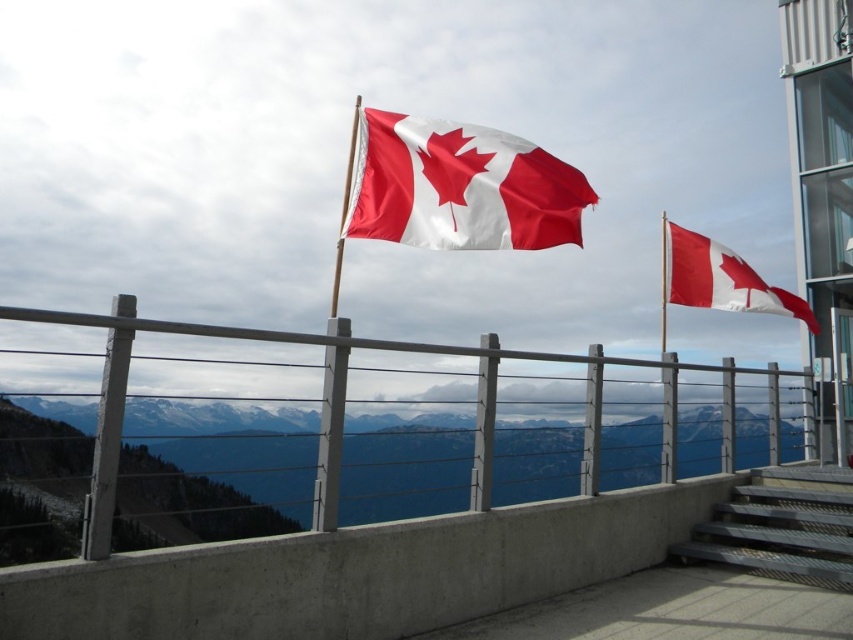
Based on the photo, you are standing at the overlook and want to descend to the parking lot below. The metallic gray stairs at lower right is your only path. If you can walk 3 feet per second, how many seconds will it take you to reach the stairs?

The metallic gray stairs at lower right is 17.77 feet away from camera. At a walking speed of 3 feet per second, it would take approximately 5.92 seconds to reach the stairs.